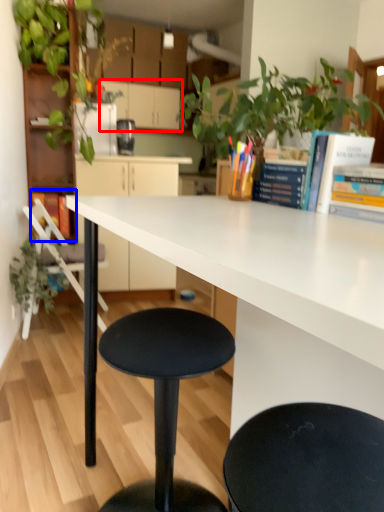
Question: Which of the following is the farthest to the observer, cabinetry (highlighted by a red box) or book (highlighted by a blue box)?

Choices:
 (A) cabinetry
 (B) book

Answer: (A)